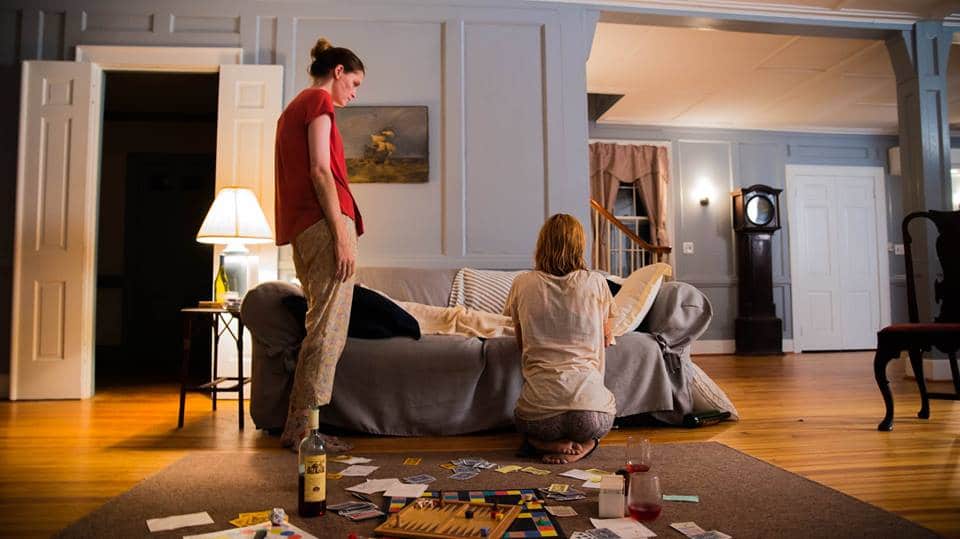
The height and width of the screenshot is (539, 960). Identify the location of window. pyautogui.click(x=626, y=202).